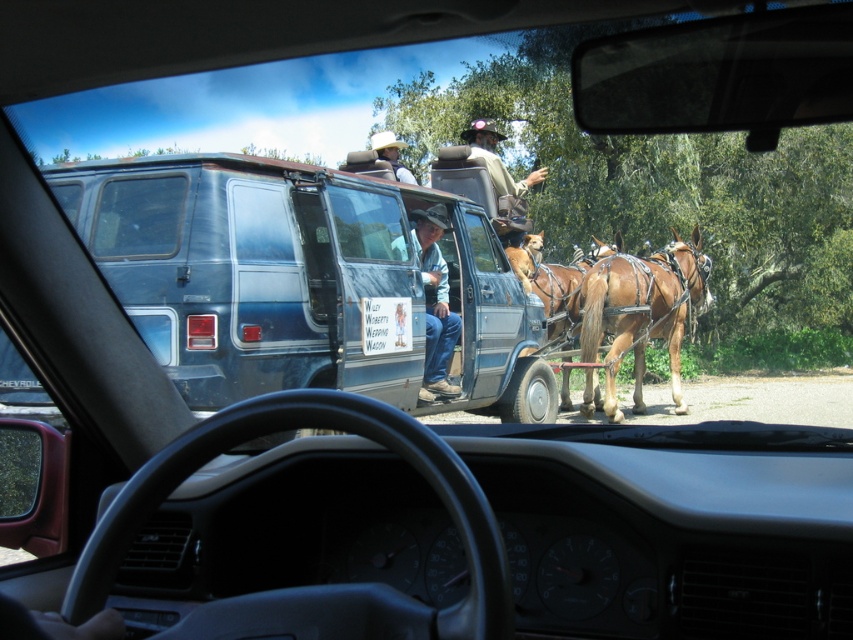
Question: Can you confirm if brown glossy horse at center is thinner than matte white cowboy hat at upper center?

Choices:
 (A) no
 (B) yes

Answer: (A)

Question: Among these objects, which one is nearest to the camera?

Choices:
 (A) brown glossy horse at center
 (B) blue metallic van at center
 (C) brown glossy horse at right
 (D) matte white cowboy hat at upper center

Answer: (B)

Question: Observing the image, what is the correct spatial positioning of brown glossy horse at center in reference to matte white cowboy hat at upper center?

Choices:
 (A) above
 (B) below

Answer: (B)

Question: Among these points, which one is nearest to the camera?

Choices:
 (A) (157, 177)
 (B) (440, 358)
 (C) (563, 273)

Answer: (A)

Question: Which object is farther from the camera taking this photo?

Choices:
 (A) blue jeans at center
 (B) blue metallic van at center
 (C) brown glossy horse at right

Answer: (C)

Question: Is brown glossy horse at center closer to camera compared to brown glossy horse at right?

Choices:
 (A) no
 (B) yes

Answer: (A)